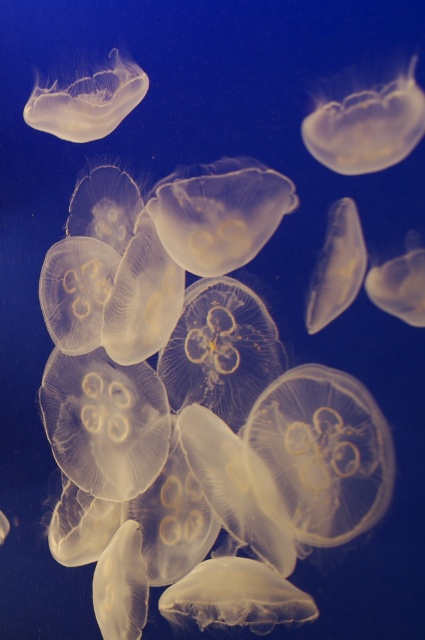
Question: Which object is closer to the camera taking this photo?

Choices:
 (A) translucent gelatinous at upper center
 (B) translucent gelatinous at center

Answer: (A)

Question: Does translucent gelatinous at upper center appear on the right side of translucent gelatinous at center?

Choices:
 (A) no
 (B) yes

Answer: (B)

Question: In this image, where is translucent gelatinous at upper center located relative to translucent gelatinous at upper left?

Choices:
 (A) left
 (B) right

Answer: (B)

Question: Which object appears farthest from the camera in this image?

Choices:
 (A) translucent gelatinous at center
 (B) translucent gelatinous at upper left

Answer: (B)

Question: Among these points, which one is nearest to the camera?

Choices:
 (A) (351, 202)
 (B) (317, 157)

Answer: (A)

Question: Is translucent gelatinous at upper left closer to camera compared to translucent gelatinous at center?

Choices:
 (A) yes
 (B) no

Answer: (B)